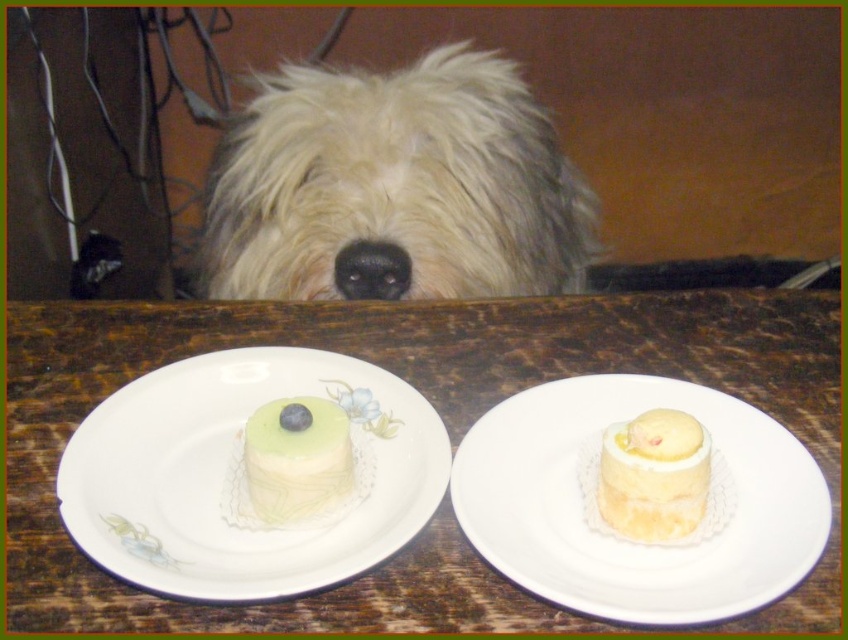
You are standing in a room with two cakes on plates and a dog. The dog is at point (395, 182). If you want to place a new plate between the two existing cakes, where should you position it relative to the white fluffy dog at upper center?

The new plate should be placed between the two existing cakes, which are located to the left and right of the white fluffy dog at upper center. Since the dog is at point (395, 182), positioning the new plate between the two cakes would mean placing it closer to the dog than either of the cakes.

You are standing in front of the cakes on the white ceramic plates at center. If you move 0.3 units to the right and 0.2 units forward from your current position, will you be closer to the cakes?

The white ceramic plates at center are located at point (441, 419). Moving 0.3 units right and 0.2 units forward would place you at (611, 611), which is farther away from the plates. Therefore, you will not be closer to the cakes.

You are a chef who wants to serve two cakes on plates. The white porcelain plate at center and the white ceramic plate at center are available. If you want to choose the bigger plate for the cake with the heart decoration, which plate should you choose?

The white porcelain plate at center is larger than the white ceramic plate at center, so you should choose the white porcelain plate at center for the cake with the heart decoration.